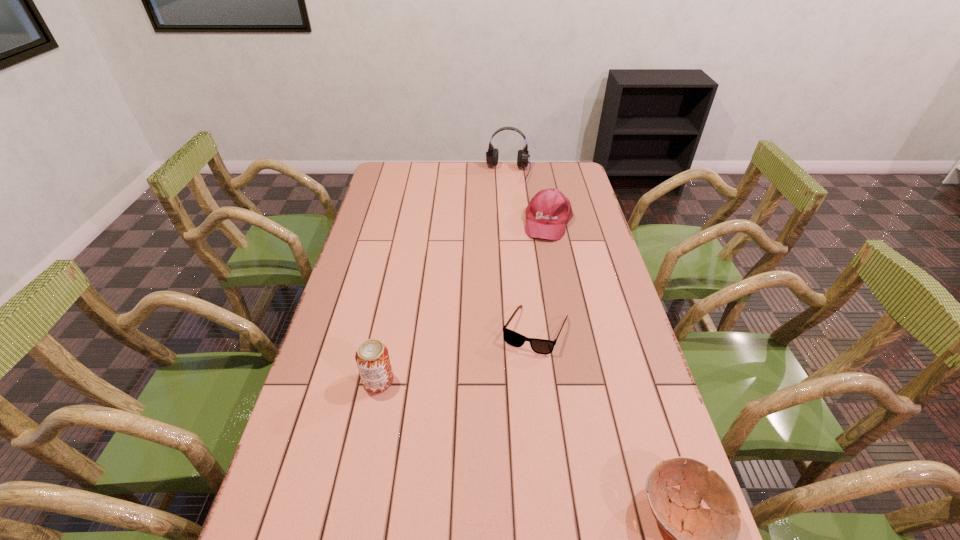
You are a GUI agent. You are given a task and a screenshot of the screen. Output one action in this format:
    pyautogui.click(x=<x>, y=<y>)
    Task: Click on the free space on the desktop that is between the leftmost object and the bowl and is positioned at the front of the baseball cap with the brim
    
    Given the screenshot: What is the action you would take?
    pyautogui.click(x=497, y=434)

Locate an element on the screen. The image size is (960, 540). vacant space on the desktop that is between the leftmost object and the fourth tallest object and is positioned on the front-facing side of the third farthest object is located at coordinates (498, 434).

The width and height of the screenshot is (960, 540). In order to click on free space on the desktop that is between the second nearest object and the fourth tallest object and is positioned on the ear cushions of the headset in this screenshot , I will do `click(475, 424)`.